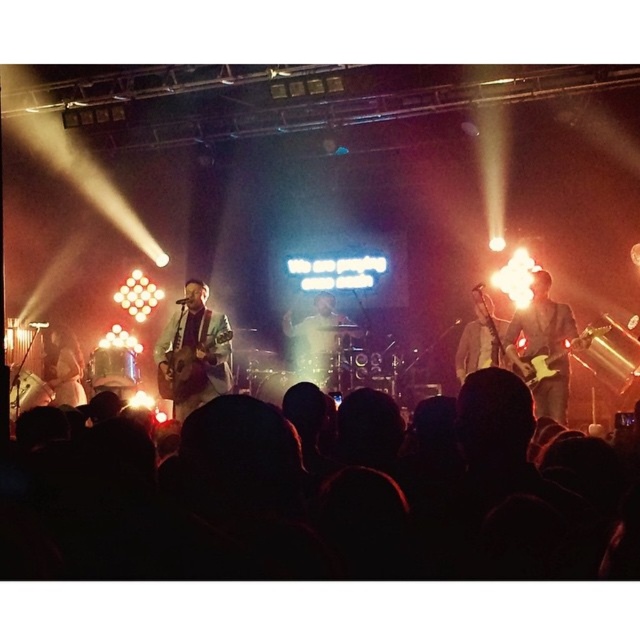
Question: Can you confirm if white matte microphone at center is positioned to the left of matte brown guitar at center?

Choices:
 (A) no
 (B) yes

Answer: (A)

Question: Can you confirm if black matte crowd at lower center is positioned to the left of white fabric shirt at left?

Choices:
 (A) yes
 (B) no

Answer: (B)

Question: Estimate the real-world distances between objects in this image. Which object is farther from the matte brown guitar at right?

Choices:
 (A) black matte crowd at lower center
 (B) matte light blue jacket at center
 (C) white matte microphone at center
 (D) white fabric shirt at left

Answer: (D)

Question: Which of the following is the closest to the observer?

Choices:
 (A) matte brown guitar at right
 (B) black matte crowd at lower center
 (C) white fabric shirt at left
 (D) matte light blue jacket at center

Answer: (B)

Question: Considering the relative positions of white matte microphone at center and matte brown guitar at center in the image provided, where is white matte microphone at center located with respect to matte brown guitar at center?

Choices:
 (A) above
 (B) below

Answer: (A)

Question: Which is farther from the matte light blue jacket at center?

Choices:
 (A) black matte crowd at lower center
 (B) matte brown guitar at right
 (C) matte brown guitar at center
 (D) white fabric shirt at left

Answer: (A)